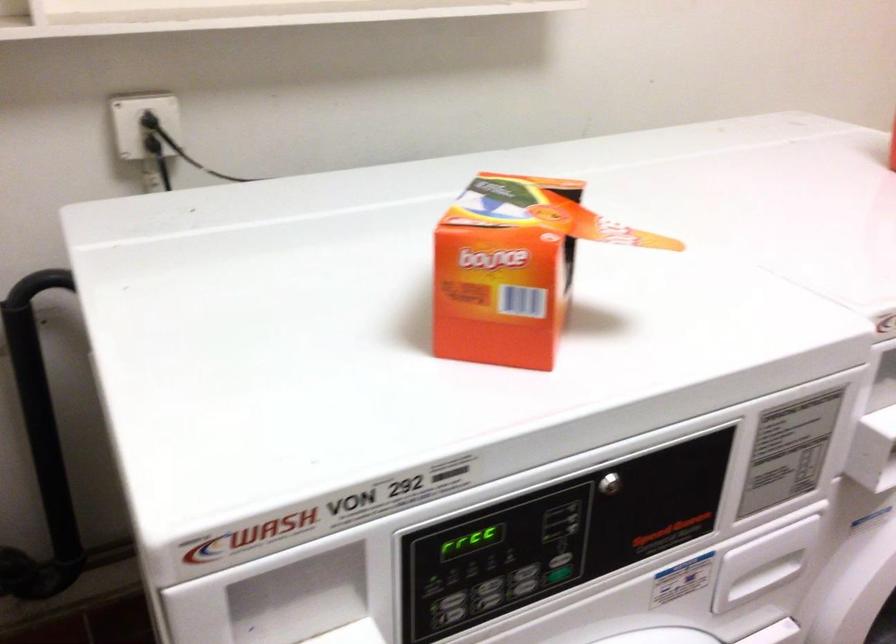
You are a GUI agent. You are given a task and a screenshot of the screen. Output one action in this format:
    pyautogui.click(x=<x>, y=<y>)
    Task: Click on the green control button
    The height and width of the screenshot is (644, 896).
    Given the screenshot: What is the action you would take?
    pyautogui.click(x=558, y=573)